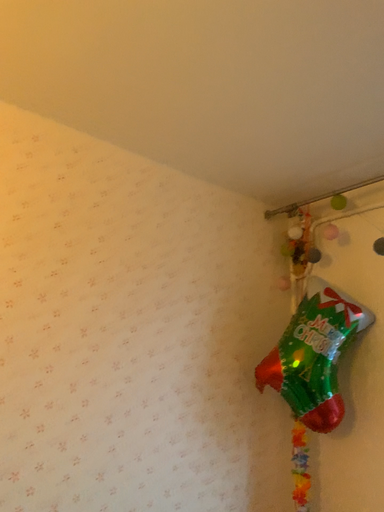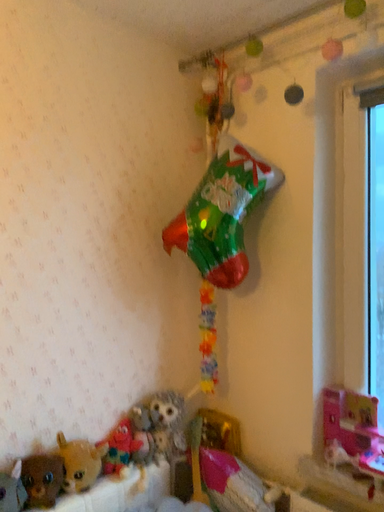
Question: Which way did the camera rotate in the video?

Choices:
 (A) rotated right
 (B) rotated left

Answer: (A)